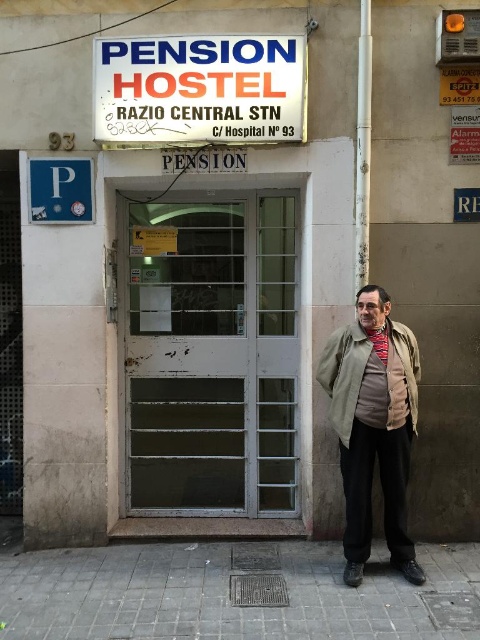
Question: Is olive green fabric trench coat at center to the right of striped wool scarf at center from the viewer's perspective?

Choices:
 (A) yes
 (B) no

Answer: (B)

Question: Which point is farther from the camera taking this photo?

Choices:
 (A) (355, 385)
 (B) (384, 340)
 (C) (360, 349)

Answer: (B)

Question: Can you confirm if khaki fabric jacket at center is bigger than blue plastic parking sign at upper left?

Choices:
 (A) no
 (B) yes

Answer: (B)

Question: Is blue plastic parking sign at upper left to the left of striped wool scarf at center from the viewer's perspective?

Choices:
 (A) yes
 (B) no

Answer: (A)

Question: Which of these objects is positioned closest to the striped wool scarf at center?

Choices:
 (A) olive green fabric trench coat at center
 (B) white plastic sign at upper center

Answer: (A)

Question: Which point appears farthest from the camera in this image?

Choices:
 (A) (46, 177)
 (B) (399, 355)
 (C) (368, 330)
 (D) (335, 374)

Answer: (A)